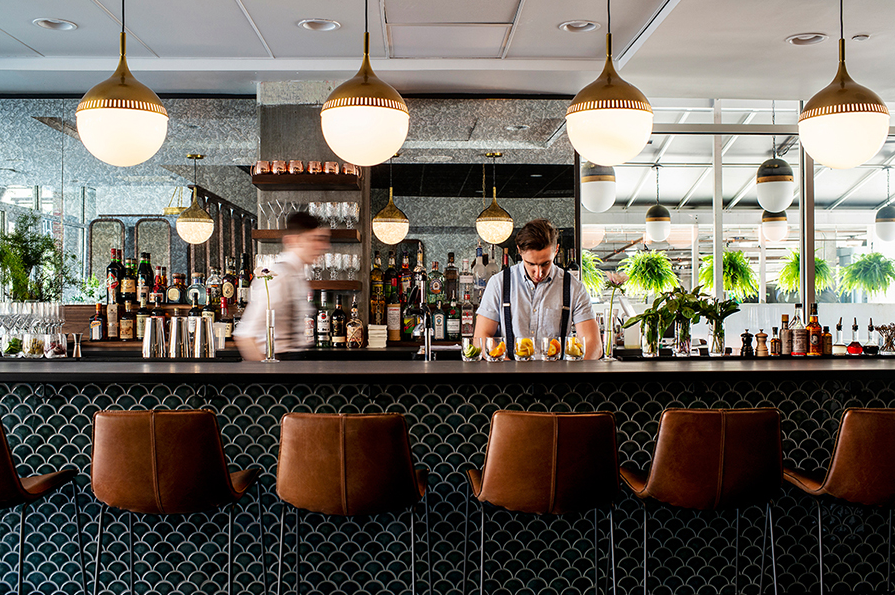
Locate an element on the screen. bottles is located at coordinates (107, 284), (132, 281), (142, 274), (128, 328), (116, 324), (94, 331).